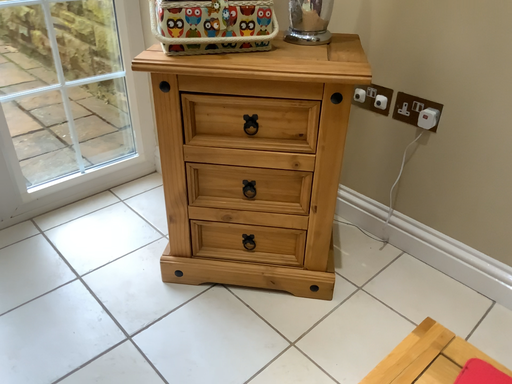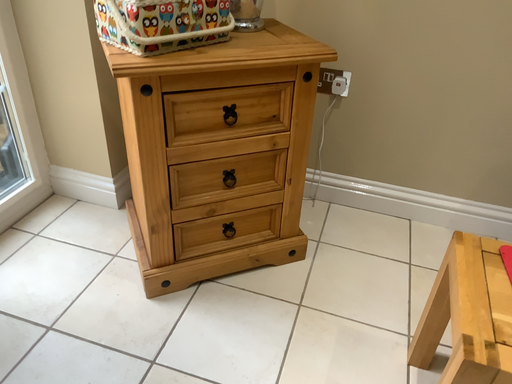
Question: Which way did the camera rotate in the video?

Choices:
 (A) rotated left
 (B) rotated right

Answer: (B)